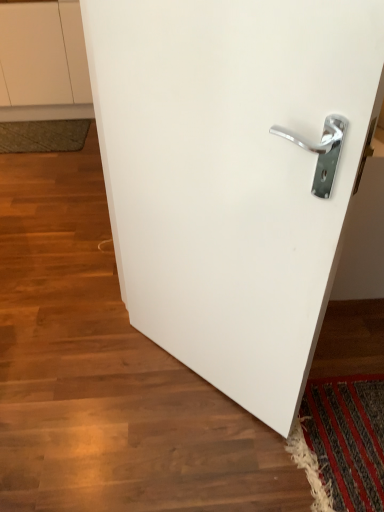
Locate an element on the screen. The height and width of the screenshot is (512, 384). white glossy door handle at center is located at coordinates (231, 175).

The height and width of the screenshot is (512, 384). What do you see at coordinates (231, 175) in the screenshot?
I see `white glossy door handle at center` at bounding box center [231, 175].

Identify the location of white glossy door handle at center. Image resolution: width=384 pixels, height=512 pixels. (231, 175).